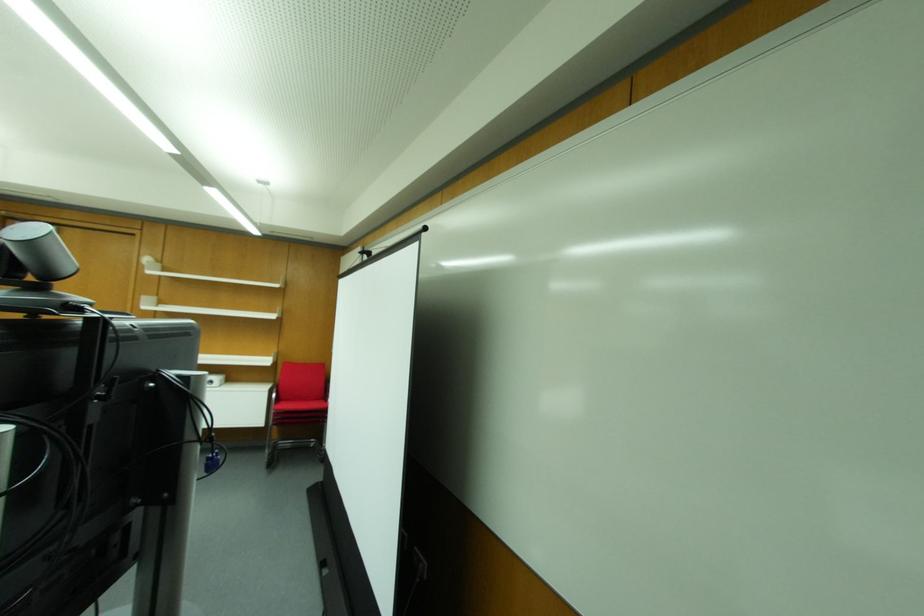
Find where to pull the projector screen handle. Please return your answer as a coordinate pair (x, y).

(84, 381)